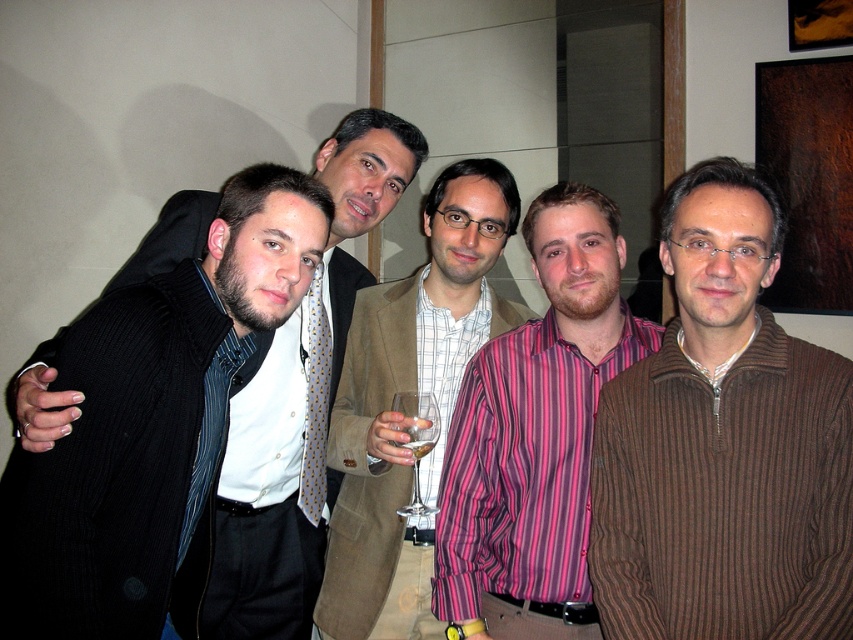
You are a photographer setting up for a group photo. You notice the brown ribbed sweater at right and the clear glass wine glass at center. Which object is wider?

The brown ribbed sweater at right is wider than the clear glass wine glass at center.

You are standing in the room and want to locate the brown ribbed sweater at right. According to the coordinates provided, where would you find it?

The brown ribbed sweater at right is located at coordinates point (x=723, y=444).

You are a photographer setting up for a group photo. You notice two sweaters in the scene, the brown ribbed sweater at right and the matte black sweater at left. Which sweater is closer to the camera?

The brown ribbed sweater at right is positioned under the matte black sweater at left, meaning it is closer to the camera.